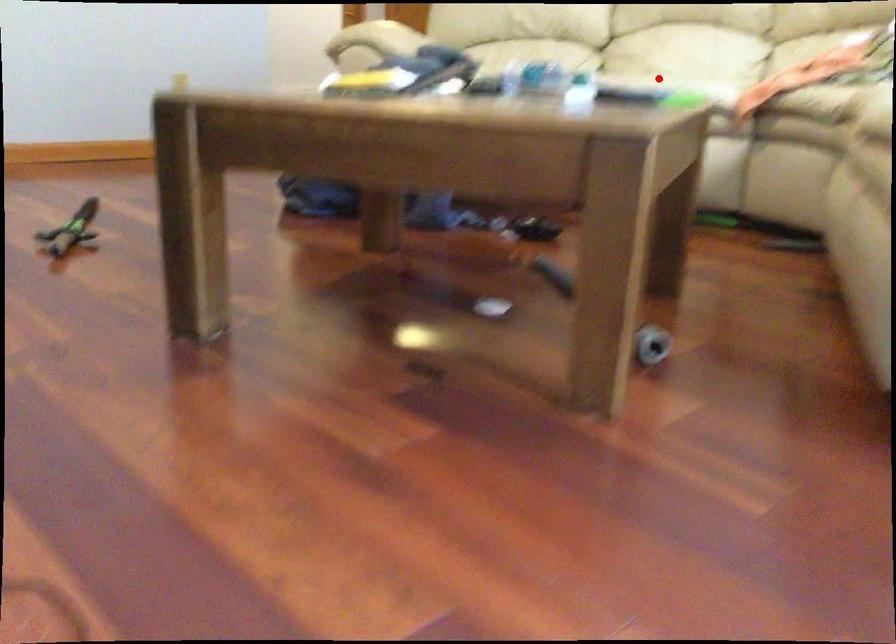
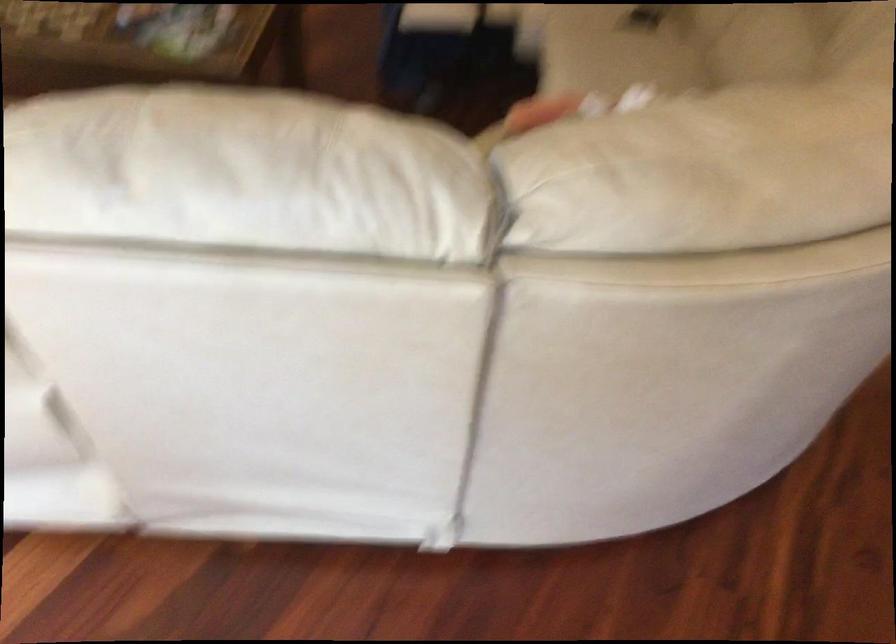
Find the pixel in the second image that matches the highlighted location in the first image.

(616, 49)